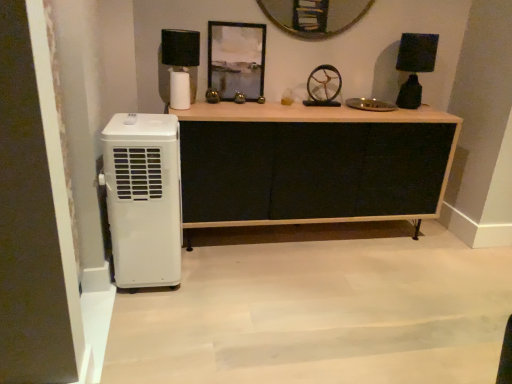
Identify the location of free space to the left of metallic gold wheel at center. (296, 104).